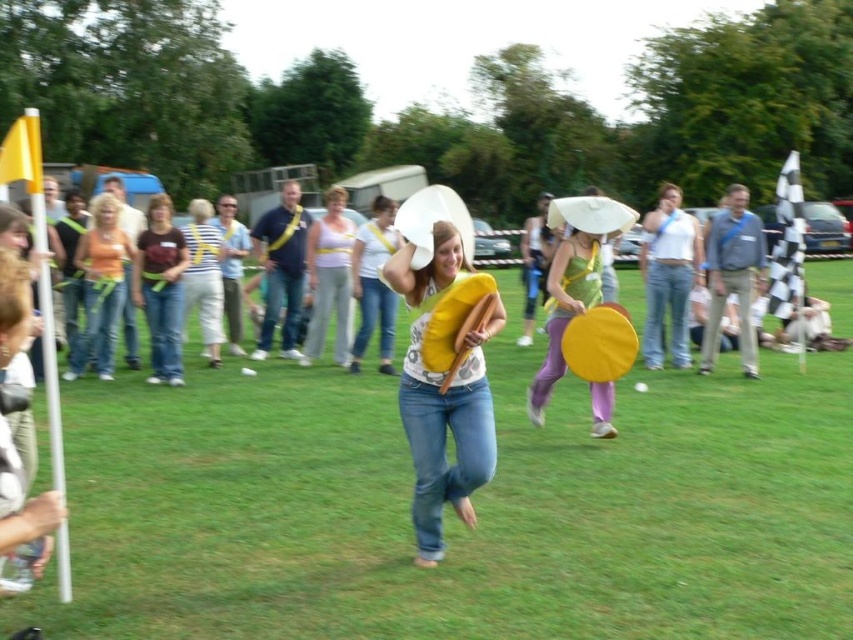
Question: Estimate the real-world distances between objects in this image. Which object is farther from the matte yellow frisbee at center?

Choices:
 (A) striped fabric top at center
 (B) yellow matte shirt at center
 (C) matte white tank top at center

Answer: (A)

Question: Considering the real-world distances, which object is farthest from the yellow matte shirt at center?

Choices:
 (A) matte white tank top at center
 (B) striped fabric top at center

Answer: (B)

Question: Among these objects, which one is farthest from the camera?

Choices:
 (A) matte white tank top at center
 (B) denim jeans at center
 (C) green grass at center
 (D) matte yellow frisbee at center

Answer: (A)

Question: Is denim jeans at center behind striped fabric top at center?

Choices:
 (A) no
 (B) yes

Answer: (A)

Question: Can you confirm if orange denim jeans at left is positioned to the right of matte white tank top at center?

Choices:
 (A) yes
 (B) no

Answer: (B)

Question: Can you confirm if green grass at center is positioned below striped fabric top at center?

Choices:
 (A) no
 (B) yes

Answer: (B)